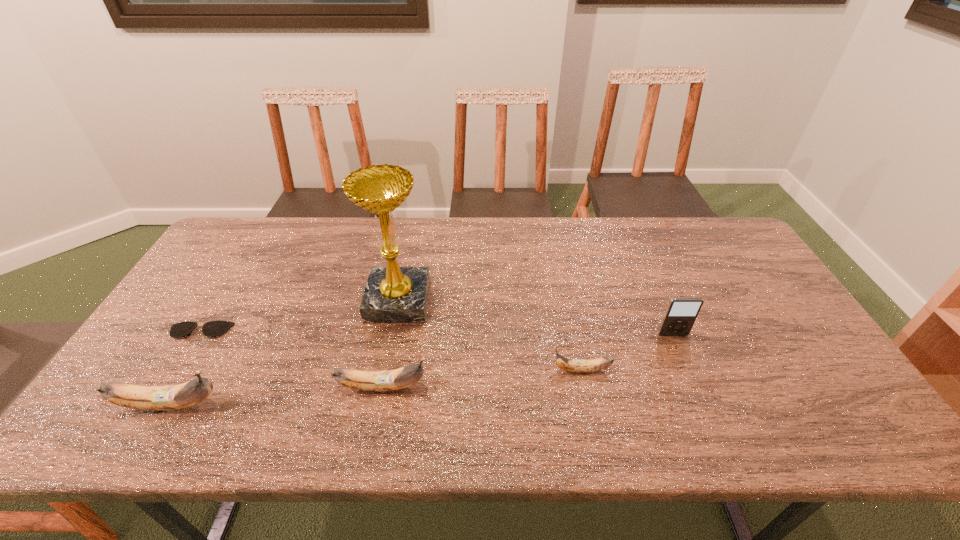
Identify the location of vacant space located 0.140m on the peel of the fifth tallest object. (494, 370).

You are a GUI agent. You are given a task and a screenshot of the screen. Output one action in this format:
    pyautogui.click(x=<x>, y=<y>)
    Task: Click on the free location located 0.100m on the peel of the fifth tallest object
    This screenshot has height=540, width=960.
    Given the screenshot: What is the action you would take?
    pyautogui.click(x=511, y=370)

Where is `vacant space located 0.350m on the right of the shortest object`? Image resolution: width=960 pixels, height=540 pixels. vacant space located 0.350m on the right of the shortest object is located at coordinates (360, 331).

Find the location of a particular element. free spot located 0.120m on the front-facing side of the rightmost object is located at coordinates (689, 374).

This screenshot has width=960, height=540. Find the location of `free region located 0.360m on the front-facing side of the tallest object`. free region located 0.360m on the front-facing side of the tallest object is located at coordinates (552, 301).

Where is `banana located at the left edge`? This screenshot has width=960, height=540. banana located at the left edge is located at coordinates (168, 397).

The image size is (960, 540). In order to click on spectacles located at the left edge in this screenshot , I will do `click(212, 328)`.

Where is `object that is at the near left corner`? Image resolution: width=960 pixels, height=540 pixels. object that is at the near left corner is located at coordinates (168, 397).

Identify the location of vacant space at the far edge of the desktop. (591, 260).

In the image, there is a desktop. Where is `vacant area at the near edge`? The width and height of the screenshot is (960, 540). vacant area at the near edge is located at coordinates (269, 402).